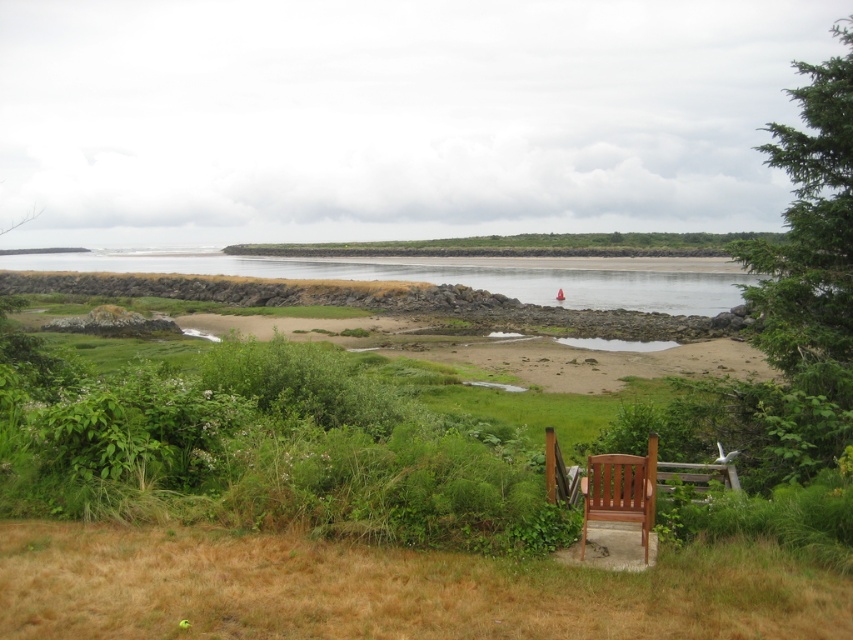
Is brown dry grass at lower center smaller than wooden chair at lower center?

Incorrect, brown dry grass at lower center is not smaller in size than wooden chair at lower center.

Can you confirm if brown dry grass at lower center is positioned to the left of wooden chair at lower center?

Yes, brown dry grass at lower center is to the left of wooden chair at lower center.

Which is behind, point (108, 627) or point (569, 492)?

The point (569, 492) is behind.

Identify the location of brown dry grass at lower center. Image resolution: width=853 pixels, height=640 pixels. (390, 589).

In the scene shown: Who is positioned more to the left, brown wood chair at center or wooden chair at lower center?

Positioned to the left is wooden chair at lower center.

How much distance is there between brown wood chair at center and wooden chair at lower center?

A distance of 23.22 inches exists between brown wood chair at center and wooden chair at lower center.

Is point (637, 516) farther from camera compared to point (552, 464)?

No, it is not.

Find the location of a particular element. This screenshot has width=853, height=640. brown wood chair at center is located at coordinates click(621, 490).

Image resolution: width=853 pixels, height=640 pixels. What do you see at coordinates (390, 589) in the screenshot? I see `brown dry grass at lower center` at bounding box center [390, 589].

Is brown dry grass at lower center wider than brown wood chair at center?

Correct, the width of brown dry grass at lower center exceeds that of brown wood chair at center.

Describe the element at coordinates (390, 589) in the screenshot. I see `brown dry grass at lower center` at that location.

The image size is (853, 640). Identify the location of brown dry grass at lower center. (390, 589).